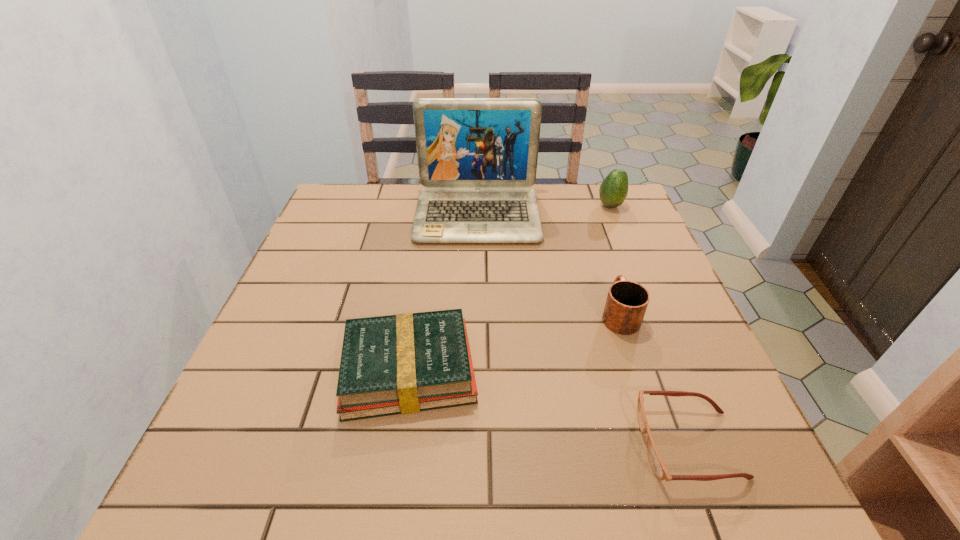
The height and width of the screenshot is (540, 960). In order to click on free region located 0.140m on the left of the hardback book in this screenshot , I will do `click(268, 369)`.

I want to click on free point located 0.060m on the front-facing side of the spectacles, so click(x=606, y=444).

Identify the location of vacant space positioned 0.320m on the front-facing side of the spectacles. This screenshot has width=960, height=540. (453, 444).

This screenshot has width=960, height=540. I want to click on free region located on the front-facing side of the spectacles, so click(442, 444).

Find the location of a particular element. The height and width of the screenshot is (540, 960). laptop computer at the far edge is located at coordinates (477, 157).

The width and height of the screenshot is (960, 540). Identify the location of avocado positioned at the far edge. (613, 191).

Where is `object positioned at the near edge`? This screenshot has width=960, height=540. object positioned at the near edge is located at coordinates (658, 466).

Image resolution: width=960 pixels, height=540 pixels. Identify the location of avocado present at the right edge. (613, 191).

Find the location of a particular element. This screenshot has height=540, width=960. mug that is positioned at the right edge is located at coordinates (627, 301).

At what (x,y) coordinates should I click in order to perform the action: click on spectacles that is at the right edge. Please return your answer as a coordinate pair (x, y). This screenshot has height=540, width=960. Looking at the image, I should click on (658, 466).